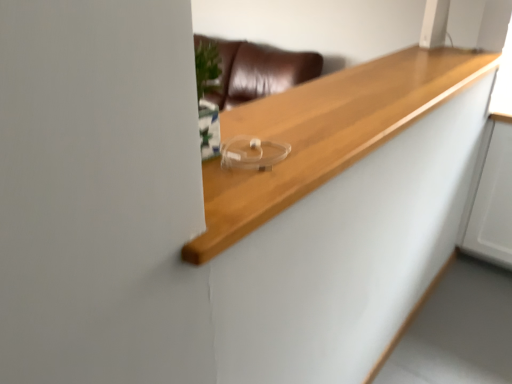
Describe the element at coordinates (325, 134) in the screenshot. I see `wooden table at center` at that location.

Identify the location of wooden table at center. (325, 134).

Locate an element on the screen. wooden table at center is located at coordinates (325, 134).